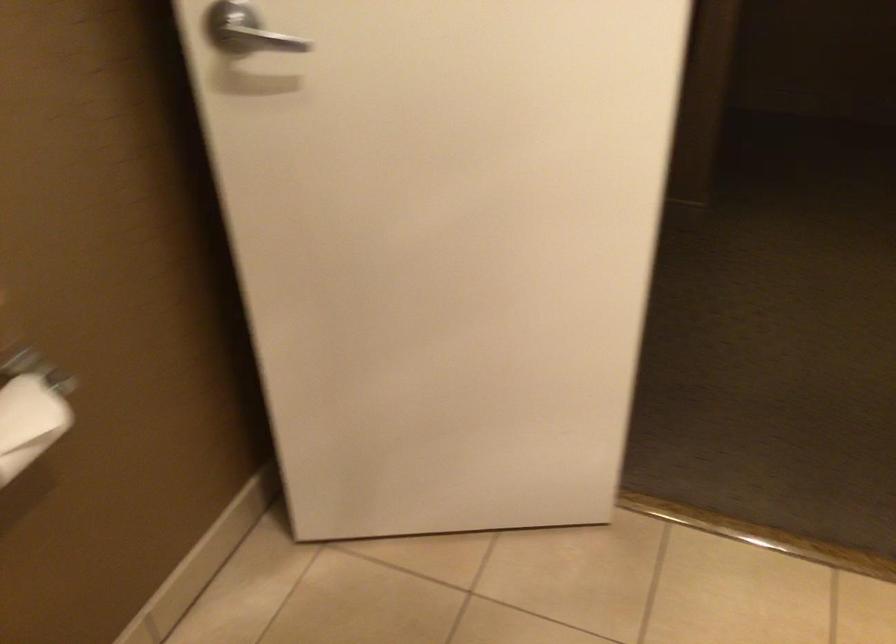
The width and height of the screenshot is (896, 644). I want to click on toilet paper roll, so click(x=29, y=422).